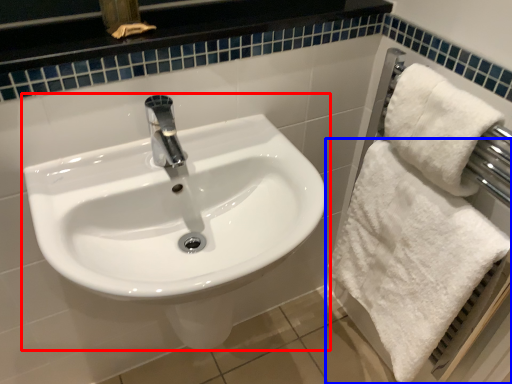
Question: Which object appears farthest to the camera in this image, sink (highlighted by a red box) or towel (highlighted by a blue box)?

Choices:
 (A) sink
 (B) towel

Answer: (B)